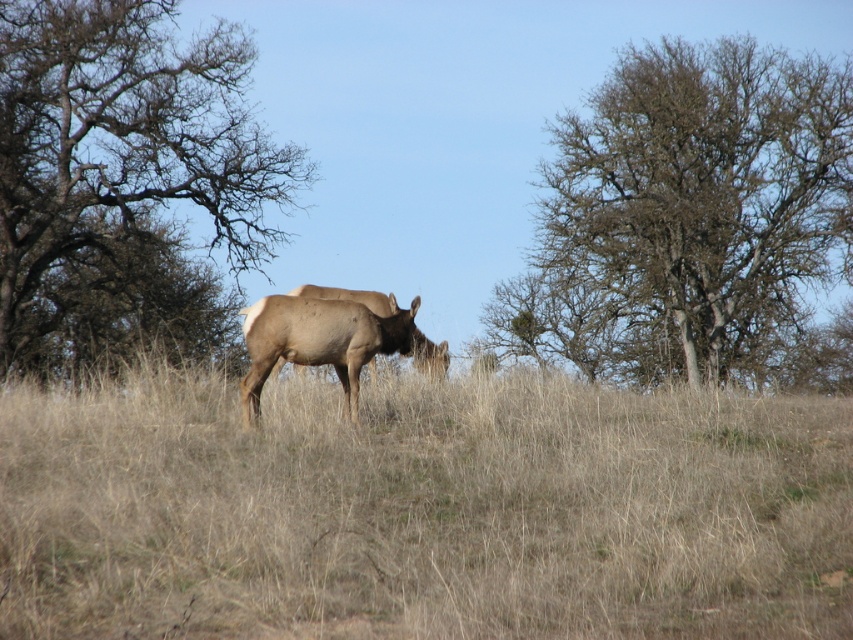
Question: Which is farther from the brown bark tree at left?

Choices:
 (A) brown furry deer at center
 (B) brown dry grass at center
 (C) brown rough bark tree at upper right

Answer: (A)

Question: Which of the following is the farthest from the observer?

Choices:
 (A) brown rough bark tree at upper right
 (B) brown bark tree at left

Answer: (A)

Question: Estimate the real-world distances between objects in this image. Which object is farther from the brown furry deer at center?

Choices:
 (A) brown dry grass at center
 (B) brown bark tree at left
 (C) brown rough bark tree at upper right

Answer: (C)

Question: Is brown dry grass at center positioned at the back of brown rough bark tree at upper right?

Choices:
 (A) yes
 (B) no

Answer: (B)

Question: Can you confirm if brown rough bark tree at upper right is positioned to the right of brown furry deer at center?

Choices:
 (A) no
 (B) yes

Answer: (B)

Question: Is brown dry grass at center positioned behind brown bark tree at left?

Choices:
 (A) yes
 (B) no

Answer: (B)